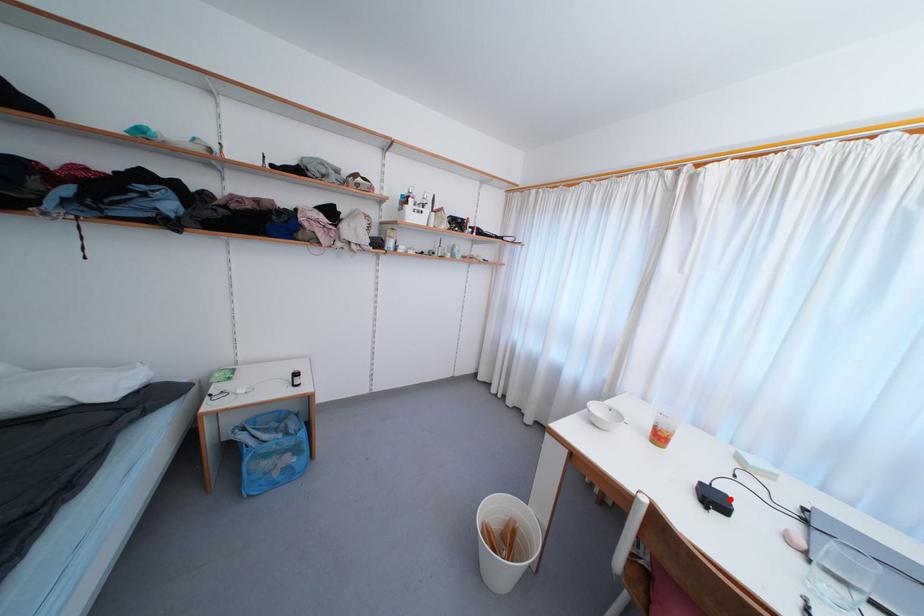
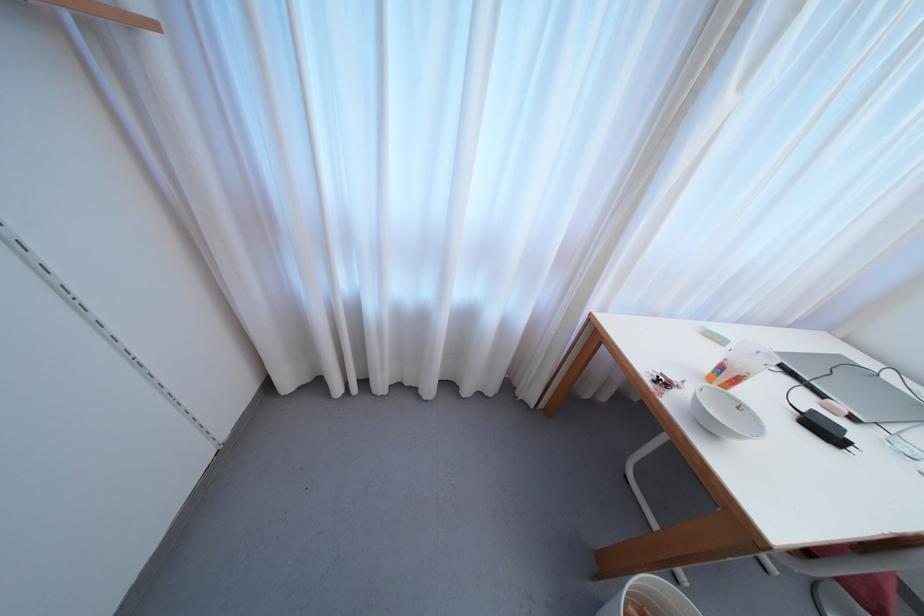
In the second image, find the point that corresponds to the highlighted location in the first image.

(817, 415)